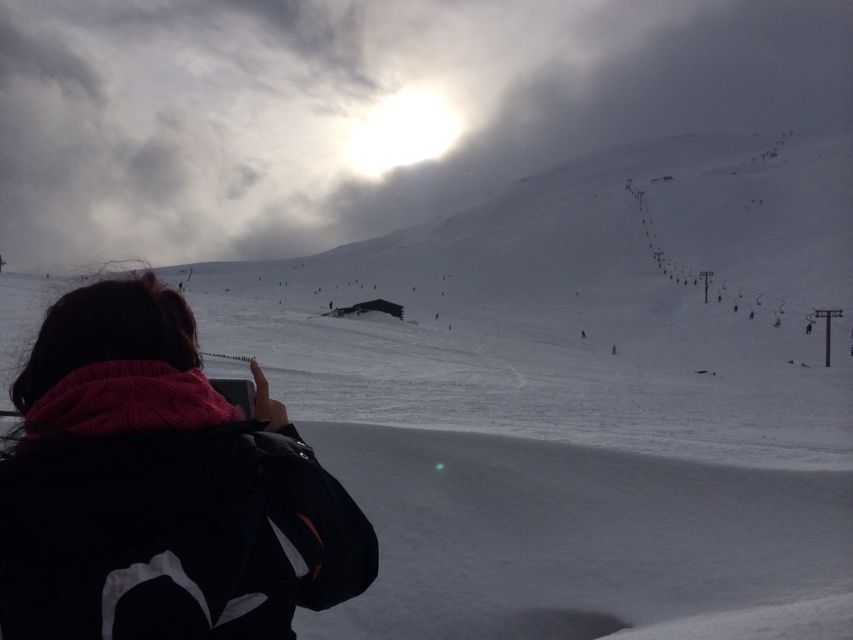
You are planning to take a photo of the cloudy white snow at upper center while standing near the black fleece jacket at lower left. Will the jacket block your view of the snow?

The cloudy white snow at upper center is above the black fleece jacket at lower left, so the jacket will not block your view of the snow.

You are a photographer standing in the snowy mountain scene. You want to take a photo that includes both the point at coordinates point (x=27, y=92) and the point at coordinates point (x=167, y=529). Which point should you focus on first to ensure both are in sharp focus?

You should focus on the point at coordinates point (x=27, y=92) first because it is closer to the camera than point (x=167, y=529). By focusing on the closer point, the farther point will also be in focus due to the depth of field.